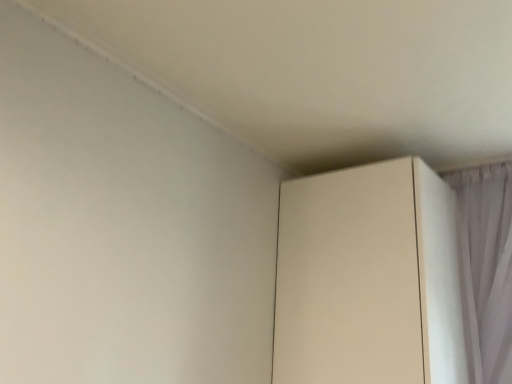
I want to click on matte white cupboard at upper right, so click(368, 278).

What is the approximate height of matte white cupboard at upper right?

It is 34.35 inches.

Describe the element at coordinates (368, 278) in the screenshot. I see `matte white cupboard at upper right` at that location.

Where is `matte white cupboard at upper right`? The width and height of the screenshot is (512, 384). matte white cupboard at upper right is located at coordinates (368, 278).